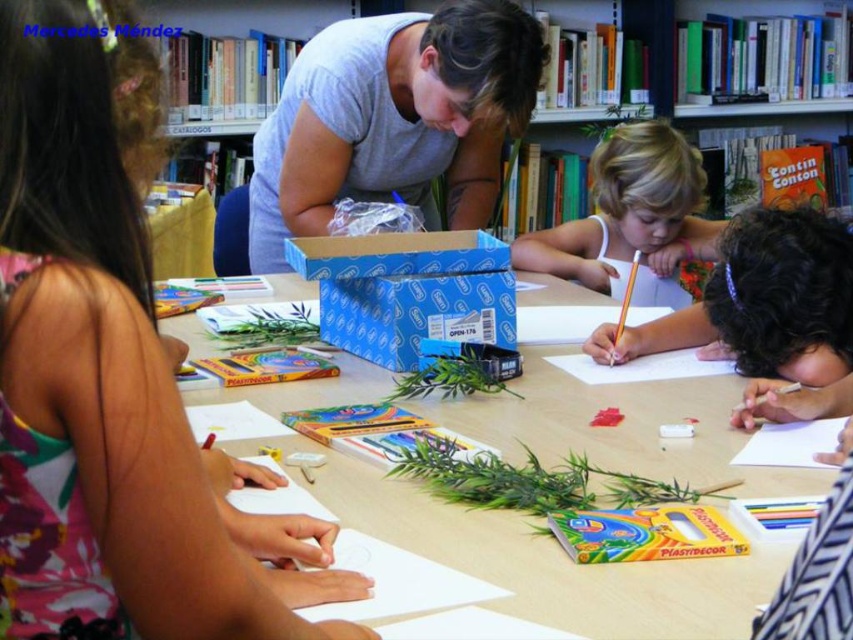
Can you confirm if wooden table at center is positioned below gray matte shirt at center?

Correct, wooden table at center is located below gray matte shirt at center.

Does wooden table at center have a greater height compared to gray matte shirt at center?

Incorrect, wooden table at center's height is not larger of gray matte shirt at center's.

Find the location of a particular element. wooden table at center is located at coordinates (543, 560).

Does white paper at center appear over blonde hair at center?

Incorrect, white paper at center is not positioned above blonde hair at center.

Who is shorter, white paper at center or blonde hair at center?

white paper at center is shorter.

Where is `white paper at center`? white paper at center is located at coordinates (762, 301).

What do you see at coordinates (543, 560) in the screenshot? I see `wooden table at center` at bounding box center [543, 560].

Does point (827, 476) lie behind point (782, 378)?

No, (827, 476) is in front of (782, 378).

Which is in front, point (524, 390) or point (607, 336)?

Positioned in front is point (524, 390).

Find the location of a particular element. The width and height of the screenshot is (853, 640). wooden table at center is located at coordinates (543, 560).